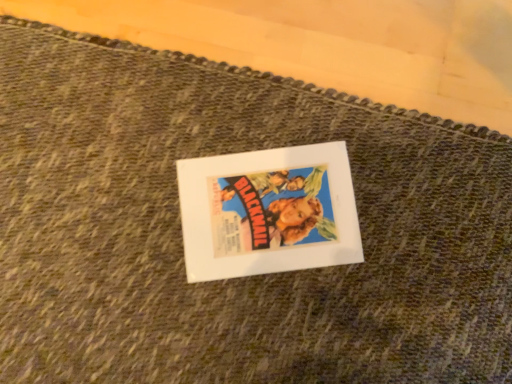
Question: Should I look upward or downward to see white paper at center?

Choices:
 (A) up
 (B) down

Answer: (B)